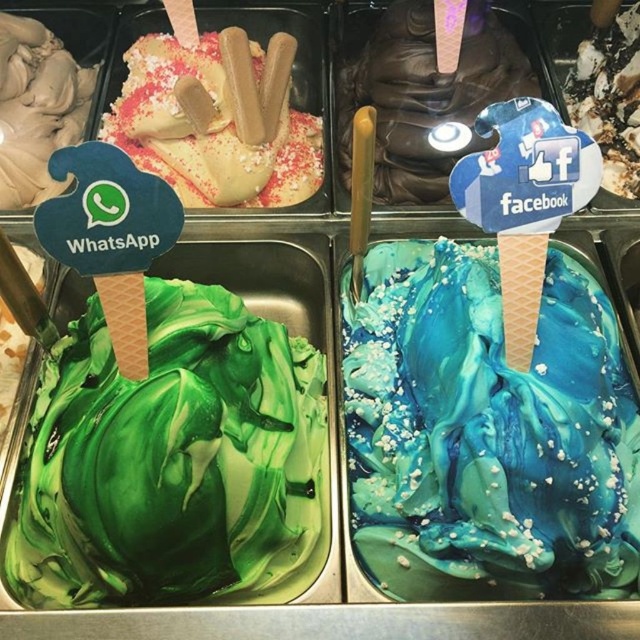
Is smooth chocolate ice cream at center closer to the viewer compared to smooth chocolate ice cream cone at upper center?

No, smooth chocolate ice cream at center is further to the viewer.

This screenshot has width=640, height=640. I want to click on smooth chocolate ice cream at center, so click(x=420, y=92).

Is point (234, 600) positioned in front of point (371, 56)?

Yes.

Does green marbled ice cream at left appear under smooth chocolate ice cream at center?

Yes.

Measure the distance between green marbled ice cream at left and camera.

green marbled ice cream at left is 31.45 inches away from camera.

The height and width of the screenshot is (640, 640). I want to click on green marbled ice cream at left, so click(173, 461).

Can you confirm if blue marbled ice cream at center is positioned above smooth chocolate ice cream cone at upper center?

No, blue marbled ice cream at center is not above smooth chocolate ice cream cone at upper center.

Does point (522, 481) come in front of point (128, 67)?

Yes, it is in front of point (128, 67).

What do you see at coordinates (486, 433) in the screenshot? The height and width of the screenshot is (640, 640). I see `blue marbled ice cream at center` at bounding box center [486, 433].

The width and height of the screenshot is (640, 640). What are the coordinates of `blue marbled ice cream at center` in the screenshot? It's located at (486, 433).